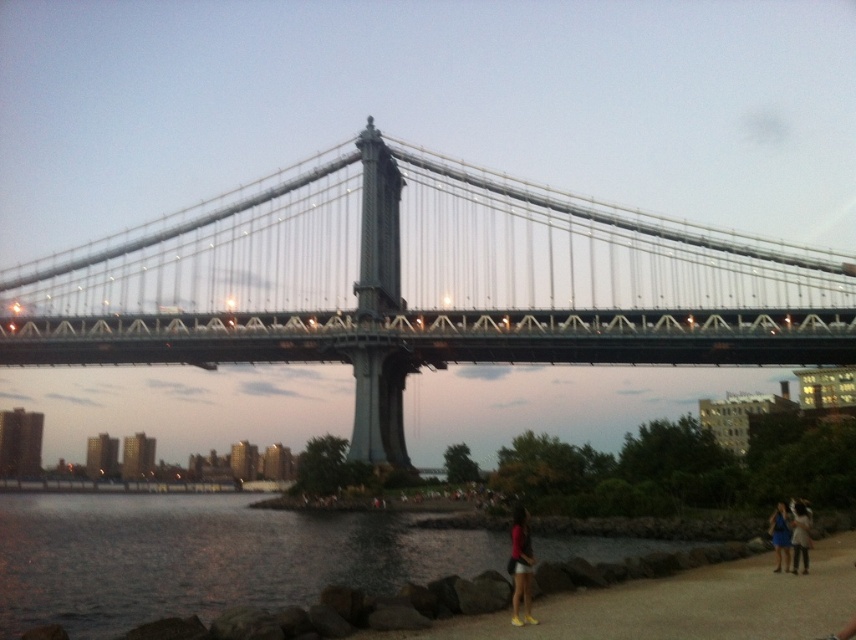
Question: Which object is positioned farthest from the matte pink dress at lower right?

Choices:
 (A) dark water at lower left
 (B) blue fabric dress at lower right
 (C) black metal bridge at upper center
 (D) light brown leather jacket at lower right

Answer: (C)

Question: Can you confirm if matte pink dress at lower right is bigger than blue fabric dress at lower right?

Choices:
 (A) no
 (B) yes

Answer: (B)

Question: Which object appears farthest from the camera in this image?

Choices:
 (A) light brown leather jacket at lower right
 (B) matte pink dress at lower right
 (C) black metal bridge at upper center
 (D) blue fabric dress at lower right

Answer: (C)

Question: Is the position of dark water at lower left more distant than that of matte pink dress at lower right?

Choices:
 (A) yes
 (B) no

Answer: (A)

Question: Can you confirm if black metal bridge at upper center is positioned to the right of dark water at lower left?

Choices:
 (A) no
 (B) yes

Answer: (B)

Question: Among these objects, which one is farthest from the camera?

Choices:
 (A) black metal bridge at upper center
 (B) matte pink dress at lower right

Answer: (A)